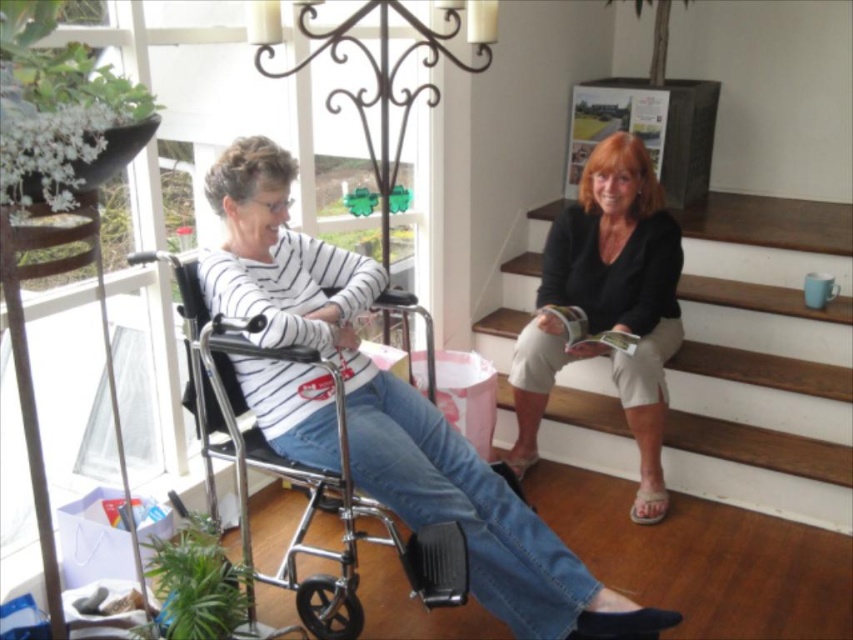
You are standing at the origin of the coordinate system in the room. The wooden stair at upper right is located at point [763,360]. If you want to reach the wooden stair at upper right, which direction should you move from the origin?

The wooden stair at upper right is located at point [763,360], so you should move towards the upper right direction to reach it.

You are a delivery person carrying a package that requires a 2.5 meter clearance to pass between the wooden stair at upper right and the wheelchair. Is there enough space for the package to go through?

The distance between the wooden stair at upper right and the wheelchair is 2.40 meters, which is less than the required 2.5 meters. The package cannot pass through safely.